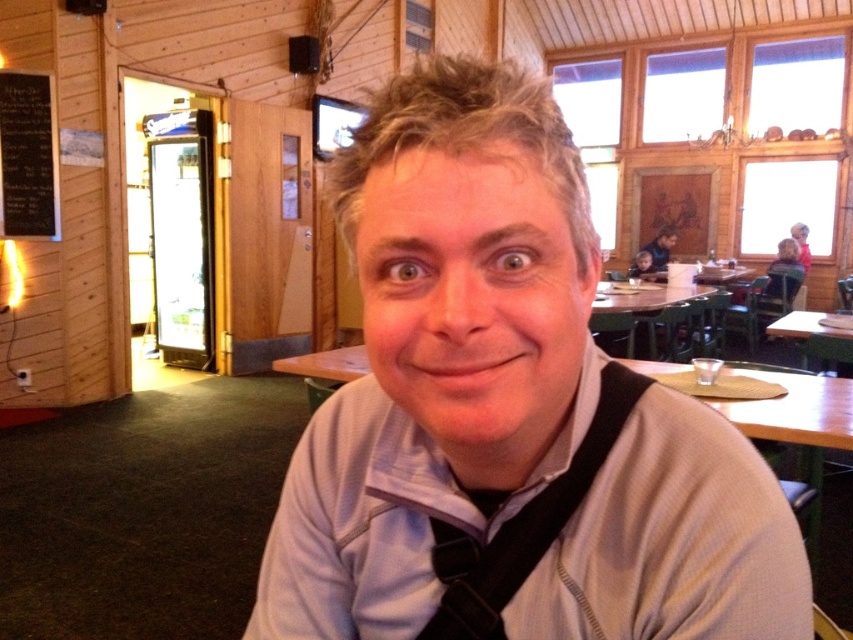
Question: Can you confirm if wooden table at center is positioned below green matte table at right?

Choices:
 (A) yes
 (B) no

Answer: (B)

Question: Does black chalkboard at left have a larger size compared to green matte table at right?

Choices:
 (A) yes
 (B) no

Answer: (B)

Question: Which point appears farthest from the camera in this image?

Choices:
 (A) (781, 332)
 (B) (489, 577)
 (C) (22, 193)
 (D) (689, 582)

Answer: (C)

Question: In this image, where is black chalkboard at left located relative to wooden table at center?

Choices:
 (A) below
 (B) above

Answer: (B)

Question: Which point is farther to the camera?

Choices:
 (A) (799, 332)
 (B) (631, 291)

Answer: (B)

Question: Among these points, which one is nearest to the camera?

Choices:
 (A) (727, 525)
 (B) (506, 586)
 (C) (654, 291)

Answer: (A)